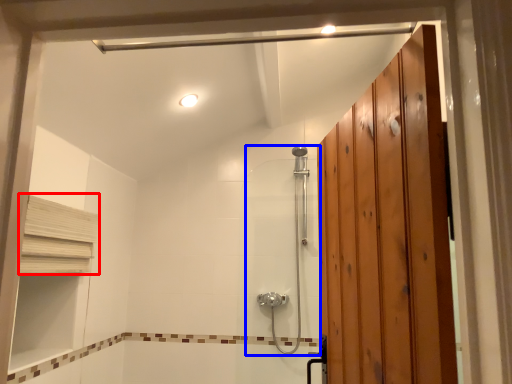
Question: Which object appears closest to the camera in this image, shelf (highlighted by a red box) or shower door (highlighted by a blue box)?

Choices:
 (A) shelf
 (B) shower door

Answer: (A)